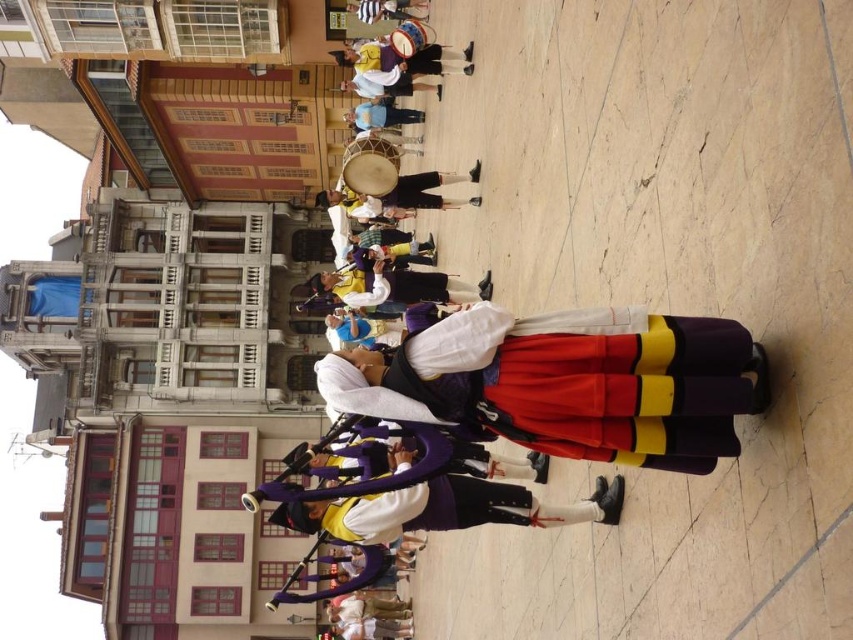
Question: Among these points, which one is nearest to the camera?

Choices:
 (A) (457, 490)
 (B) (343, 616)

Answer: (A)

Question: Does purple velvet bagpipe at center come in front of white cotton shirt at center?

Choices:
 (A) yes
 (B) no

Answer: (A)

Question: Is velvet purple skirt at center to the right of purple velvet bagpipe at center from the viewer's perspective?

Choices:
 (A) yes
 (B) no

Answer: (A)

Question: Which object is positioned farthest from the velvet purple skirt at center?

Choices:
 (A) purple velvet bagpipe at center
 (B) white cotton shirt at center

Answer: (B)

Question: Which point appears closest to the camera in this image?

Choices:
 (A) (335, 483)
 (B) (697, 429)

Answer: (B)

Question: Is velvet purple skirt at center wider than purple velvet bagpipe at center?

Choices:
 (A) no
 (B) yes

Answer: (A)